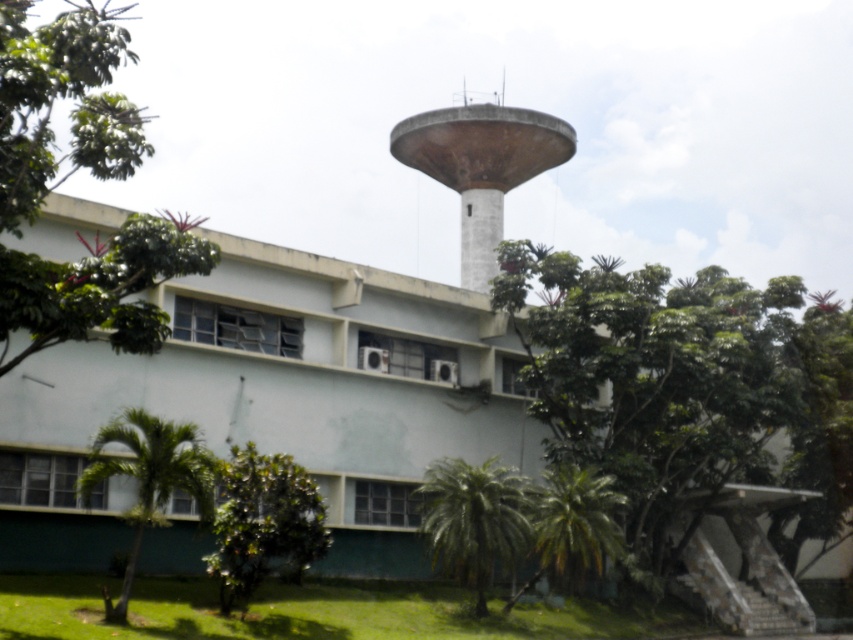
Question: Is green leafy tree at lower right above concrete water tower at upper center?

Choices:
 (A) no
 (B) yes

Answer: (A)

Question: Which of the following is the farthest from the observer?

Choices:
 (A) (329, 534)
 (B) (433, 472)

Answer: (B)

Question: Which object is positioned closest to the green leafy tree at lower right?

Choices:
 (A) concrete water tower at upper center
 (B) green leafy palm at lower left

Answer: (A)

Question: In this image, where is green leafy palm at lower center located relative to green leafy palm at lower right?

Choices:
 (A) left
 (B) right

Answer: (A)

Question: Does green leafy tree at upper left appear over green leafy palm at lower center?

Choices:
 (A) yes
 (B) no

Answer: (A)

Question: Which point is farther to the camera?

Choices:
 (A) (221, 580)
 (B) (117, 612)
 (C) (483, 536)

Answer: (C)